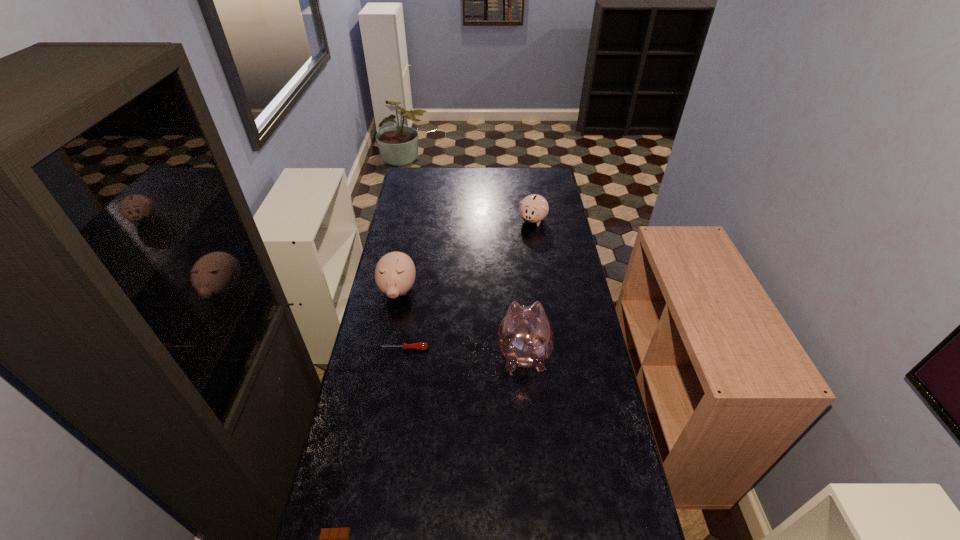
Locate an element on the screen. This screenshot has width=960, height=540. the tallest piggy bank is located at coordinates (525, 334).

Where is `the tallest object`? The image size is (960, 540). the tallest object is located at coordinates click(x=525, y=334).

The width and height of the screenshot is (960, 540). Identify the location of the fourth nearest object. (395, 272).

Where is `the leftmost piggy bank`? This screenshot has width=960, height=540. the leftmost piggy bank is located at coordinates (x=395, y=272).

This screenshot has height=540, width=960. I want to click on the shortest piggy bank, so click(534, 208).

The image size is (960, 540). Find the location of `the third shortest object`. the third shortest object is located at coordinates (534, 208).

What are the coordinates of `the second shortest object` in the screenshot? It's located at coord(416,346).

The height and width of the screenshot is (540, 960). I want to click on vacant space situated 0.280m on the front facing side of the nearest piggy bank, so click(x=517, y=278).

I want to click on vacant space located 0.180m on the front facing side of the nearest piggy bank, so click(518, 295).

Locate an element on the screen. vacant space located 0.390m on the front facing side of the nearest piggy bank is located at coordinates (516, 261).